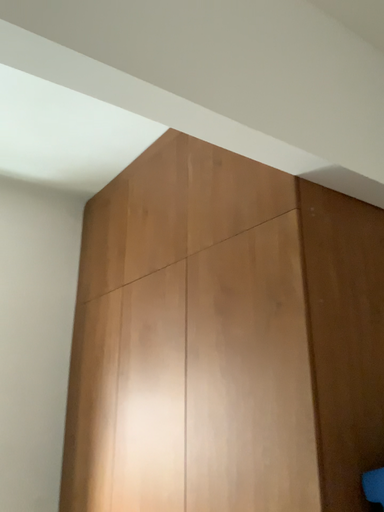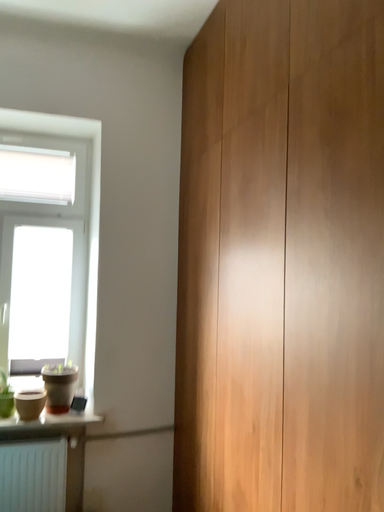
Question: How did the camera likely rotate when shooting the video?

Choices:
 (A) rotated upward
 (B) rotated downward

Answer: (B)